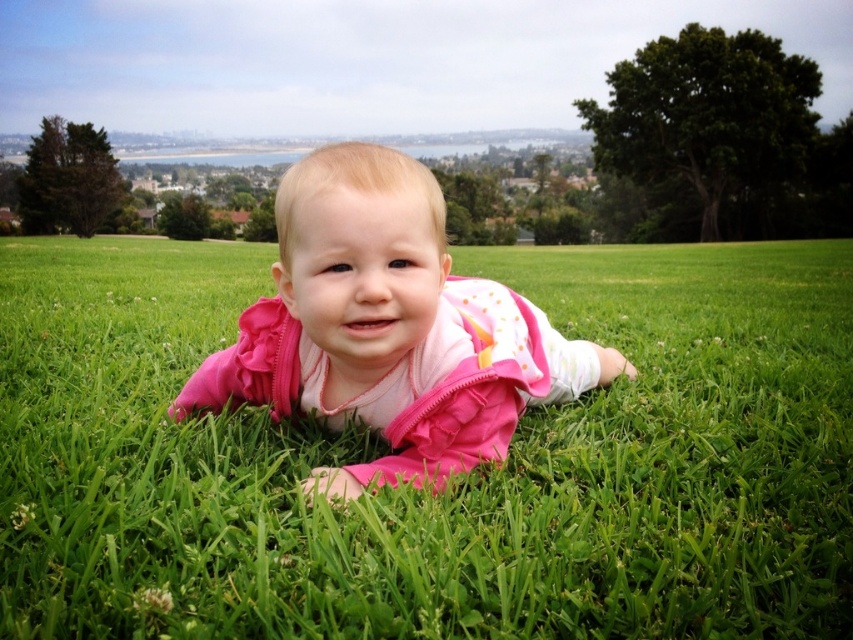
Between pink fabric baby at center and pink fleece baby at center, which one has more height?

pink fabric baby at center is taller.

Is pink fabric baby at center positioned in front of pink fleece baby at center?

That is True.

Is point (112, 419) positioned before point (438, 257)?

No, it is not.

Where is `pink fabric baby at center`? The height and width of the screenshot is (640, 853). pink fabric baby at center is located at coordinates click(x=427, y=484).